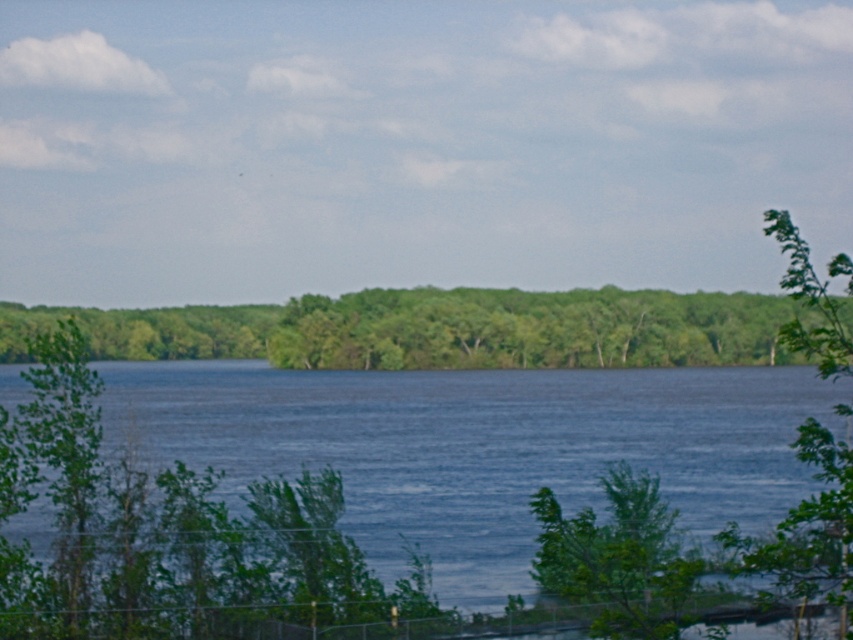
Between point (370, 540) and point (787, 266), which one is positioned behind?

The point (370, 540) is behind.

Image resolution: width=853 pixels, height=640 pixels. What do you see at coordinates (479, 445) in the screenshot?
I see `blue water at center` at bounding box center [479, 445].

What do you see at coordinates (479, 445) in the screenshot? The width and height of the screenshot is (853, 640). I see `blue water at center` at bounding box center [479, 445].

This screenshot has height=640, width=853. What are the coordinates of `blue water at center` in the screenshot? It's located at (479, 445).

Who is higher up, blue water at center or green leafy trees at center?

green leafy trees at center is higher up.

Which of these two, blue water at center or green leafy trees at center, stands shorter?

blue water at center is shorter.

This screenshot has width=853, height=640. Describe the element at coordinates (479, 445) in the screenshot. I see `blue water at center` at that location.

The width and height of the screenshot is (853, 640). I want to click on blue water at center, so click(479, 445).

Between green leafy trees at center and green leafy tree at right, which one appears on the left side from the viewer's perspective?

Positioned to the left is green leafy trees at center.

Which is behind, point (529, 330) or point (838, 564)?

Point (529, 330)

Find the location of a particular element. The image size is (853, 640). green leafy trees at center is located at coordinates click(x=434, y=330).